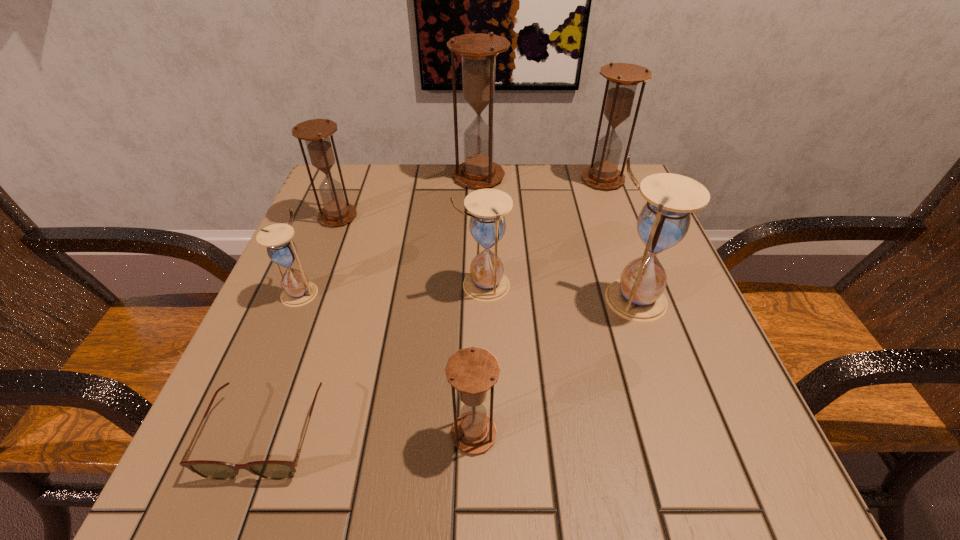
At what (x,y) coordinates should I click in order to perform the action: click on spectacles that is at the near edge. Please return your answer as a coordinate pair (x, y). Looking at the image, I should click on (269, 469).

Where is `spectacles at the left edge`? Image resolution: width=960 pixels, height=540 pixels. spectacles at the left edge is located at coordinates point(269,469).

Find the location of a particular element. The width and height of the screenshot is (960, 540). object that is at the far left corner is located at coordinates [315, 132].

Locate an element on the screen. object that is at the near left corner is located at coordinates (269, 469).

Find the location of a particular element. Image resolution: width=960 pixels, height=540 pixels. object at the far right corner is located at coordinates 622,78.

In order to click on blank space at the far edge of the desktop in this screenshot , I will do `click(515, 206)`.

You are a GUI agent. You are given a task and a screenshot of the screen. Output one action in this format:
    pyautogui.click(x=<x>, y=<y>)
    Task: Click on the free space at the near edge
    The width and height of the screenshot is (960, 540).
    Given the screenshot: What is the action you would take?
    pyautogui.click(x=516, y=456)

I want to click on vacant space at the left edge, so click(365, 268).

Where is `vacant area at the right edge of the desktop`? This screenshot has height=540, width=960. vacant area at the right edge of the desktop is located at coordinates (615, 241).

At what (x,y) coordinates should I click in order to perform the action: click on vacant space at the far left corner. Please return your answer as a coordinate pair (x, y). The height and width of the screenshot is (540, 960). Looking at the image, I should click on (381, 197).